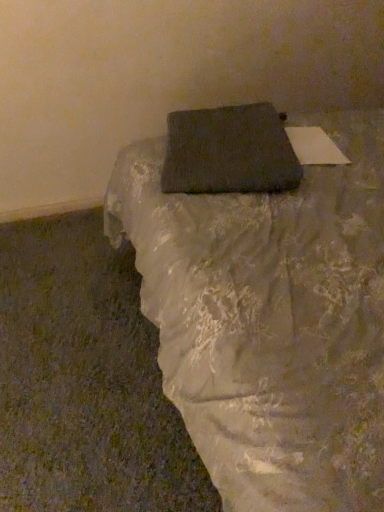
Question: From a real-world perspective, is dark gray fabric pillow at center physically above matte black book at upper center?

Choices:
 (A) yes
 (B) no

Answer: (A)

Question: Does dark gray fabric pillow at center have a greater height compared to matte black book at upper center?

Choices:
 (A) no
 (B) yes

Answer: (A)

Question: Considering the relative positions of dark gray fabric pillow at center and matte black book at upper center in the image provided, is dark gray fabric pillow at center to the right of matte black book at upper center from the viewer's perspective?

Choices:
 (A) yes
 (B) no

Answer: (B)

Question: Does dark gray fabric pillow at center have a smaller size compared to matte black book at upper center?

Choices:
 (A) no
 (B) yes

Answer: (B)

Question: Is dark gray fabric pillow at center wider than matte black book at upper center?

Choices:
 (A) yes
 (B) no

Answer: (B)

Question: Is the position of dark gray fabric pillow at center more distant than that of matte black book at upper center?

Choices:
 (A) yes
 (B) no

Answer: (A)

Question: Is matte black book at upper center far away from dark gray fabric pillow at center?

Choices:
 (A) no
 (B) yes

Answer: (A)

Question: Is matte black book at upper center located outside dark gray fabric pillow at center?

Choices:
 (A) no
 (B) yes

Answer: (B)

Question: Considering the relative positions of matte black book at upper center and dark gray fabric pillow at center in the image provided, is matte black book at upper center in front of dark gray fabric pillow at center?

Choices:
 (A) yes
 (B) no

Answer: (A)

Question: Can you confirm if matte black book at upper center is shorter than dark gray fabric pillow at center?

Choices:
 (A) no
 (B) yes

Answer: (A)

Question: Is matte black book at upper center bigger than dark gray fabric pillow at center?

Choices:
 (A) no
 (B) yes

Answer: (B)

Question: Could you tell me if matte black book at upper center is turned towards dark gray fabric pillow at center?

Choices:
 (A) yes
 (B) no

Answer: (A)

Question: Is point (248, 155) closer or farther from the camera than point (150, 266)?

Choices:
 (A) farther
 (B) closer

Answer: (A)